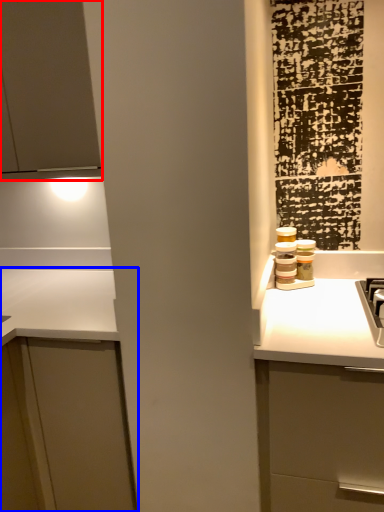
Question: Which point is further to the camera, cabinetry (highlighted by a red box) or cabinetry (highlighted by a blue box)?

Choices:
 (A) cabinetry
 (B) cabinetry

Answer: (A)